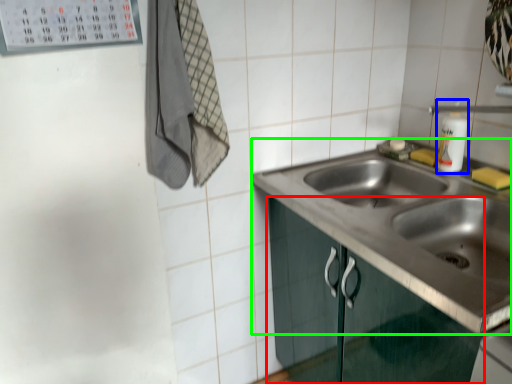
Question: Considering the real-world distances, which object is closest to cabinetry (highlighted by a red box)? bottle (highlighted by a blue box) or sink (highlighted by a green box).

Choices:
 (A) bottle
 (B) sink

Answer: (B)